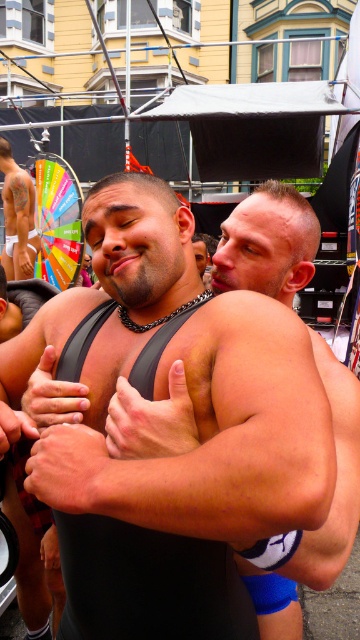
You are a photographer standing at the center of the scene. You want to take a photo that includes both point A at point (86, 464) and point B at point (342, 488). Which point should you focus on first to ensure both are in the frame?

Point A at point (86, 464) should be focused on first since it is in front of point B at point (342, 488), ensuring both are captured in the frame.

You are a photographer at the event. You want to capture a photo where the blue fabric shorts at center and the white skin tattooed man at left are both clearly visible. Based on their positions, which object is closer to the camera?

The white skin tattooed man at left is closer to the camera because the blue fabric shorts at center is located below him, meaning he is in front of the shorts.